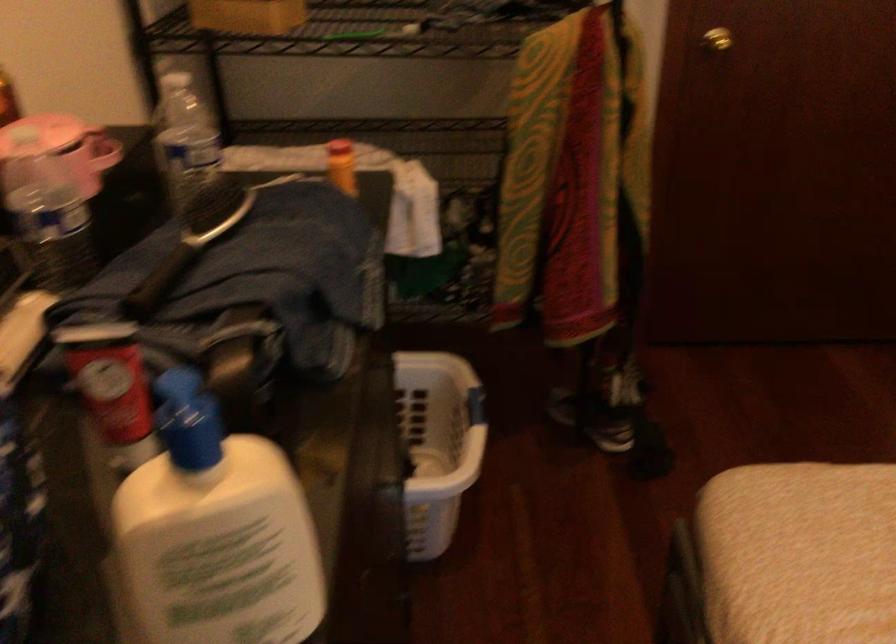
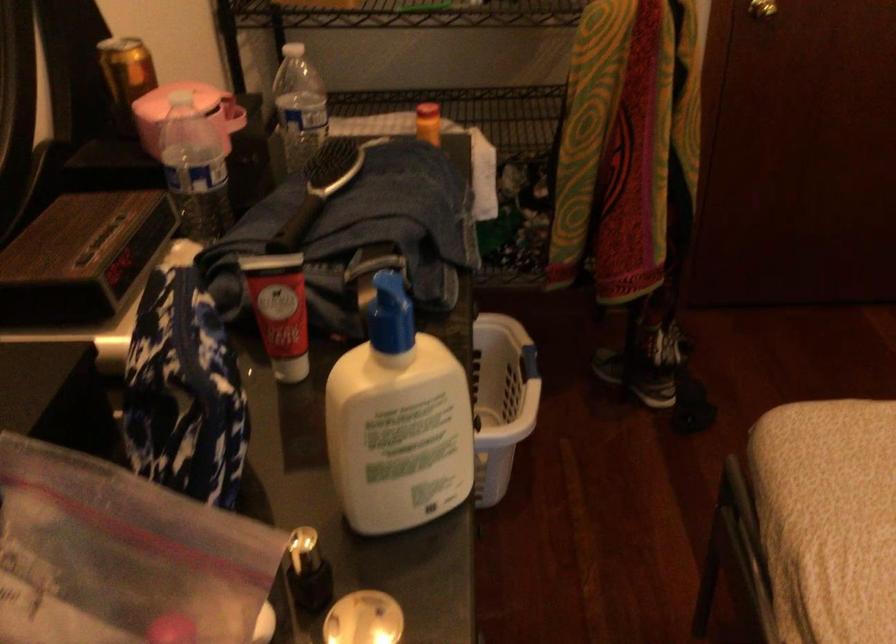
Question: The first image is from the beginning of the video and the second image is from the end. How did the camera likely rotate when shooting the video?

Choices:
 (A) Left
 (B) Right
 (C) Up
 (D) Down

Answer: (D)